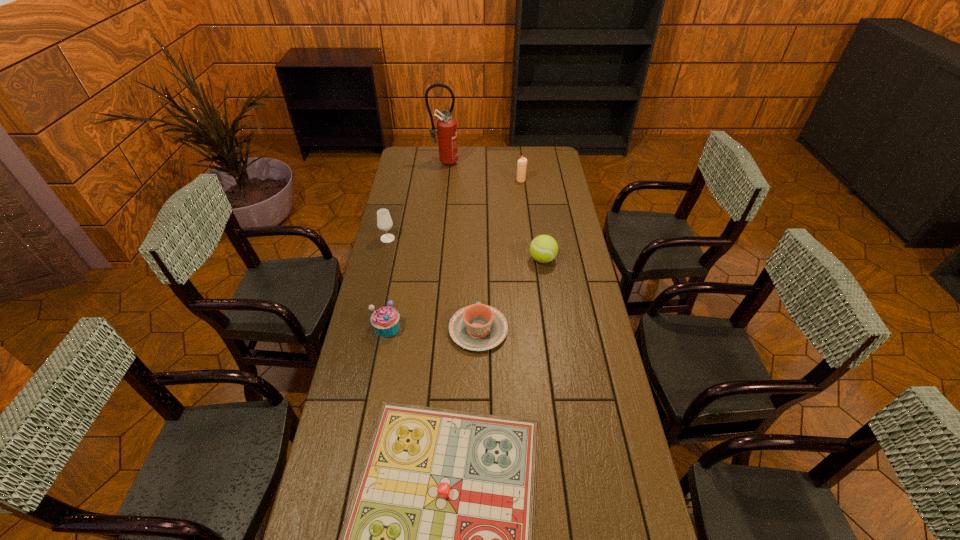
This screenshot has height=540, width=960. I want to click on free space located 0.320m on the front of the fourth farthest object, so click(x=553, y=333).

Locate an element on the screen. vacant space located on the right of the muffin is located at coordinates (468, 327).

Locate an element on the screen. The width and height of the screenshot is (960, 540). free space located on the handle side of the second shortest object is located at coordinates (479, 251).

Where is `vacant space positioned on the handle side of the second shortest object`? This screenshot has width=960, height=540. vacant space positioned on the handle side of the second shortest object is located at coordinates (479, 268).

Identify the location of free spot located on the handle side of the second shortest object. The width and height of the screenshot is (960, 540). (479, 240).

Identify the location of object at the far edge. (446, 125).

Locate an element on the screen. fire extinguisher at the left edge is located at coordinates (446, 125).

The height and width of the screenshot is (540, 960). Find the location of `glass that is at the left edge`. glass that is at the left edge is located at coordinates (384, 222).

The width and height of the screenshot is (960, 540). In order to click on muffin present at the left edge in this screenshot , I will do `click(385, 320)`.

Locate an element on the screen. The image size is (960, 540). object situated at the right edge is located at coordinates click(x=544, y=248).